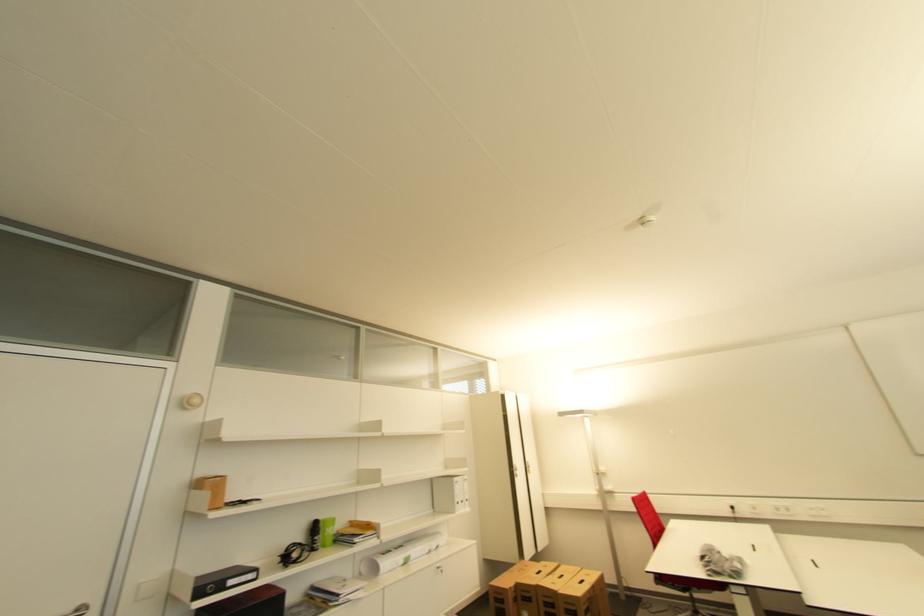
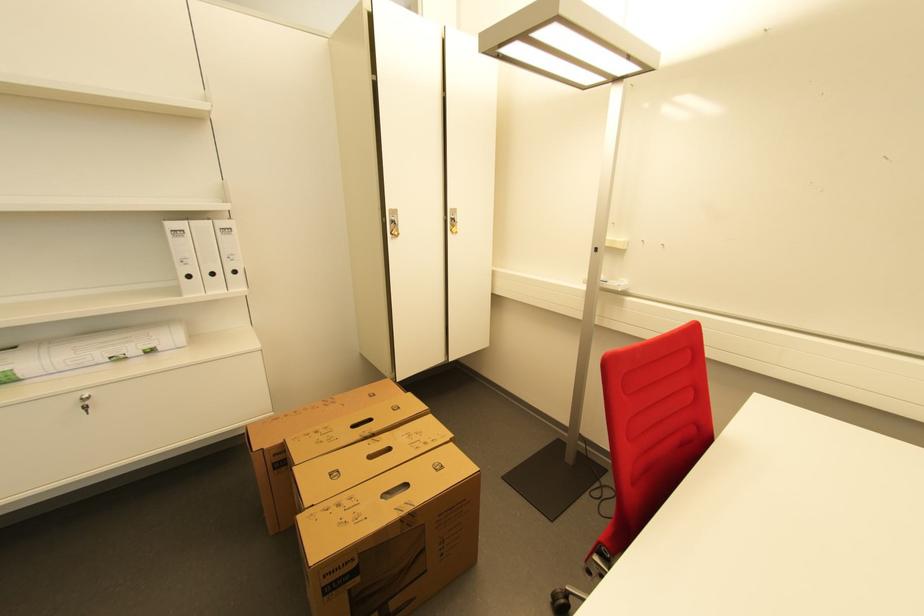
Locate, in the second image, the point that corresponds to point 460,480 in the first image.

(176, 225)